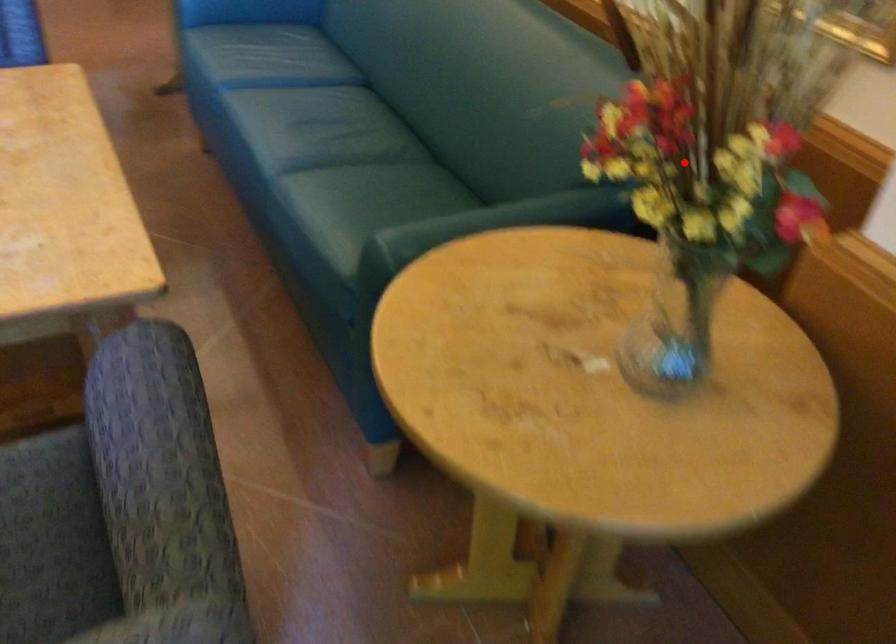
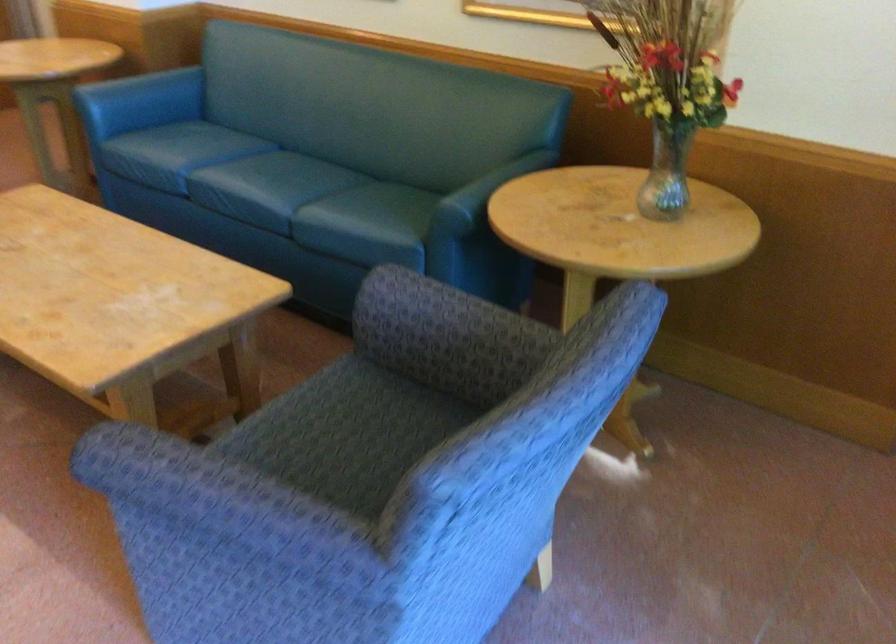
The point at the highlighted location is marked in the first image. Where is the corresponding point in the second image?

(667, 82)